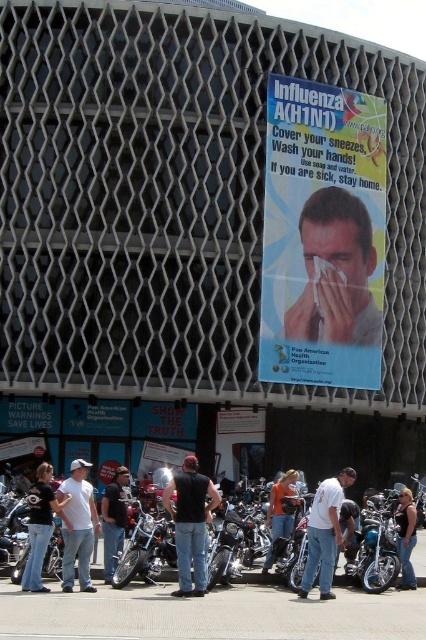
You are a delivery person who needs to attach a parcel to the blue paper poster at center and the black matte vest at center. Since the parcel is 1.5 meters wide, will it fit on both objects?

The blue paper poster at center is wider than the black matte vest at center. However, the parcel is 1.5 meters wide, so it may not fit on either object if their widths are less than 1.5 meters. The exact dimensions are not provided, so we cannot confirm.

You are a delivery person standing at the entrance of the building. You need to deliver a package to the blue paper poster at center and then to the black matte vest at center. Can you walk directly from one to the other without needing to go around any obstacles?

The distance between the blue paper poster at center and the black matte vest at center is 18.92 meters. Since there are no obstacles mentioned in the scene description, you can walk directly between them.